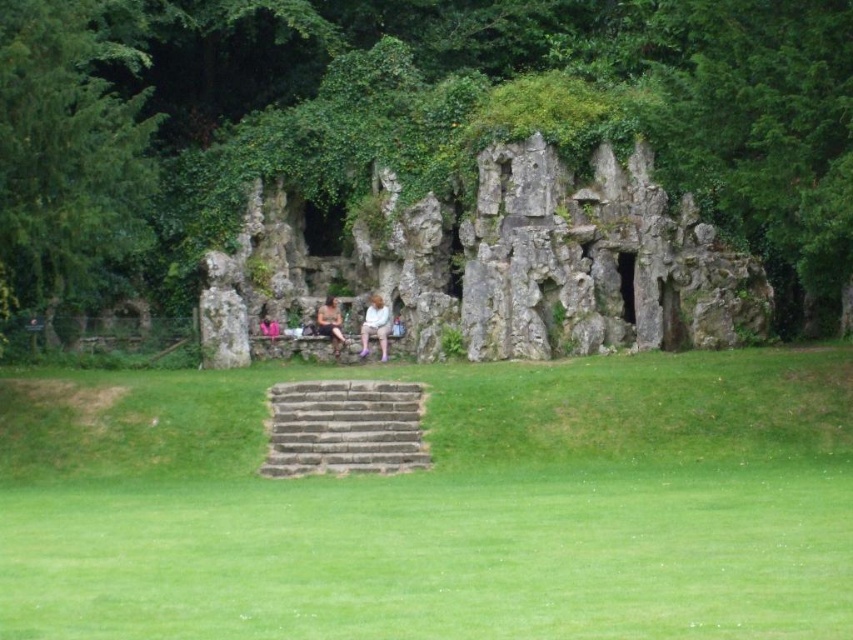
Question: Observing the image, what is the correct spatial positioning of brown stone stairs at center in reference to matte beige shirt at center?

Choices:
 (A) above
 (B) below

Answer: (B)

Question: Among these points, which one is nearest to the camera?

Choices:
 (A) (488, 8)
 (B) (438, 515)
 (C) (26, 246)

Answer: (B)

Question: Is matte white dress at center wider than matte beige shirt at center?

Choices:
 (A) no
 (B) yes

Answer: (A)

Question: Among these objects, which one is nearest to the camera?

Choices:
 (A) brown stone stairs at center
 (B) matte white dress at center

Answer: (A)

Question: Among these objects, which one is farthest from the camera?

Choices:
 (A) matte white dress at center
 (B) white cotton dress at center

Answer: (A)

Question: Is green leafy tree at upper center positioned in front of matte white dress at center?

Choices:
 (A) no
 (B) yes

Answer: (B)